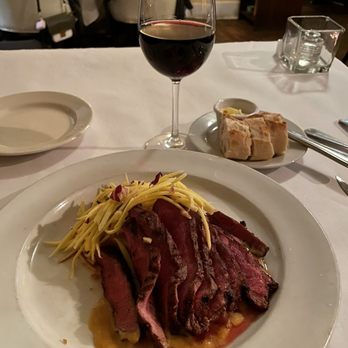
Find the location of a particular element. white tablecloth is located at coordinates (331, 106).